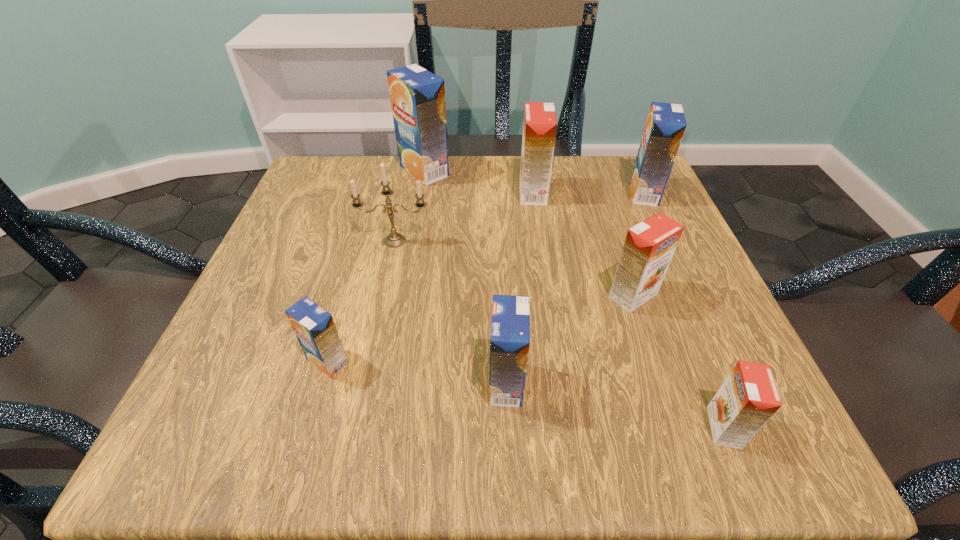
At what (x,y) coordinates should I click in order to perform the action: click on the tallest object. Please return your answer as a coordinate pair (x, y). Image resolution: width=960 pixels, height=540 pixels. Looking at the image, I should click on (x=417, y=96).

This screenshot has height=540, width=960. Identify the location of the second orange juice from left to right. (417, 96).

Identify the location of the fifth object from left to right. Image resolution: width=960 pixels, height=540 pixels. (540, 124).

This screenshot has height=540, width=960. I want to click on the fourth orange juice from right to left, so click(x=540, y=124).

I want to click on the third smallest blue orange_juice, so click(x=665, y=125).

You are a GUI agent. You are given a task and a screenshot of the screen. Output one action in this format:
    pyautogui.click(x=<x>, y=<y>)
    Task: Click on the metallic candle
    The image size is (960, 540).
    Given the screenshot: What is the action you would take?
    pyautogui.click(x=393, y=240)

Locate an element on the screen. The image size is (960, 540). candle is located at coordinates (393, 240).

The image size is (960, 540). I want to click on the second smallest orange orange juice, so (x=649, y=246).

Find the location of a particular element. The image size is (960, 540). the second nearest orange orange juice is located at coordinates (649, 246).

Where is `the fourth object from left to right`? This screenshot has width=960, height=540. the fourth object from left to right is located at coordinates (510, 328).